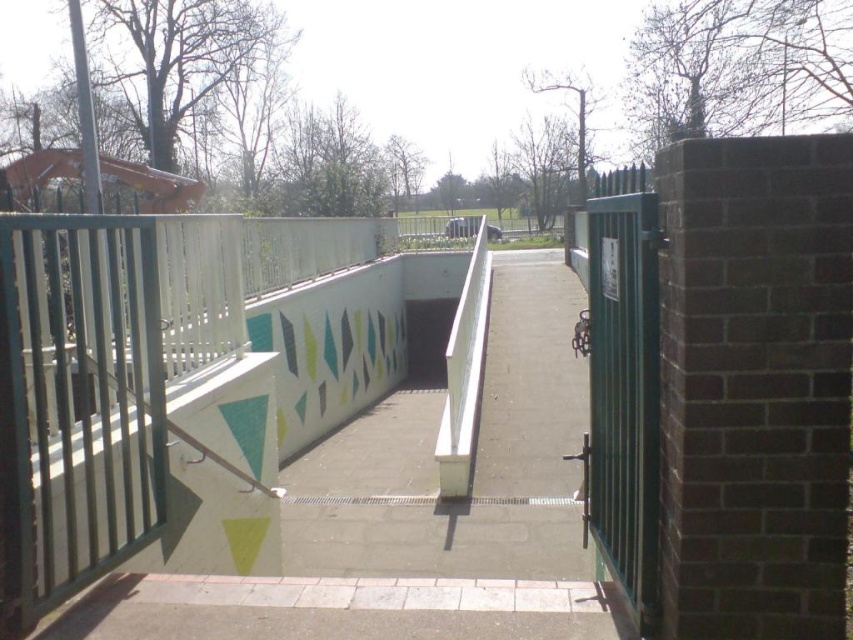
Question: Does white concrete path at center have a larger size compared to green metallic gate at right?

Choices:
 (A) yes
 (B) no

Answer: (A)

Question: Which point is closer to the camera?

Choices:
 (A) white concrete path at center
 (B) green metallic gate at right

Answer: (B)

Question: Does white concrete path at center appear under green metallic gate at right?

Choices:
 (A) no
 (B) yes

Answer: (B)

Question: Which object appears farthest from the camera in this image?

Choices:
 (A) white concrete path at center
 (B) green metallic gate at right

Answer: (A)

Question: Does white concrete path at center have a lesser width compared to green metallic gate at right?

Choices:
 (A) yes
 (B) no

Answer: (B)